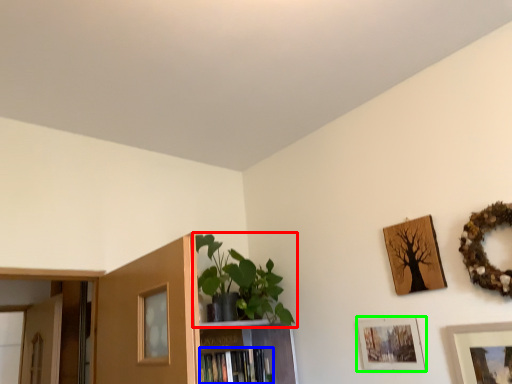
Question: Based on their relative distances, which object is nearer to houseplant (highlighted by a red box)? Choose from book (highlighted by a blue box) and picture frame (highlighted by a green box).

Choices:
 (A) book
 (B) picture frame

Answer: (A)